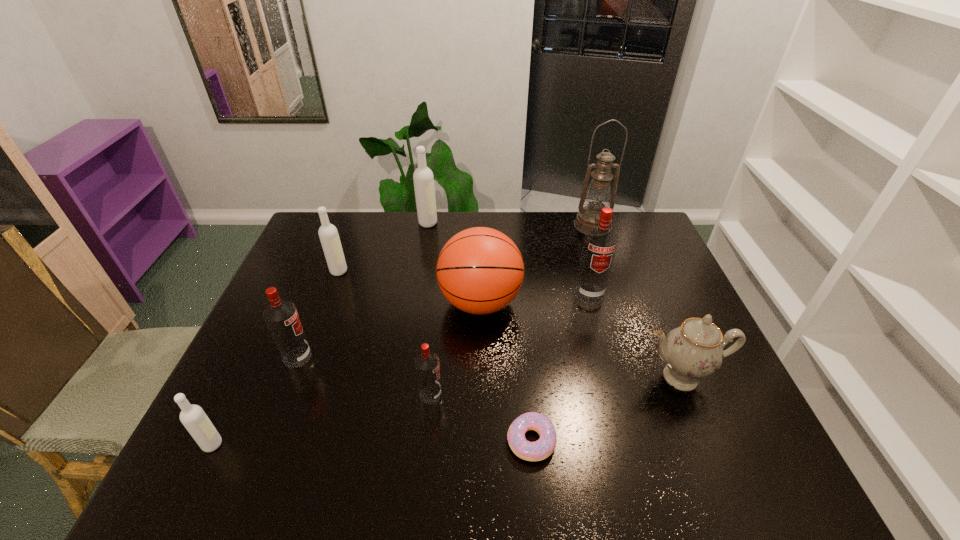
Locate an element on the screen. The width and height of the screenshot is (960, 540). vacant region located on the back of the orange basketball is located at coordinates point(480,239).

At what (x,y) coordinates should I click in order to perform the action: click on free space located 0.380m on the right of the second farthest vodka. Please return your answer as a coordinate pair (x, y). The height and width of the screenshot is (540, 960). Looking at the image, I should click on (465, 271).

This screenshot has width=960, height=540. I want to click on free space located 0.380m on the front label of the third nearest vodka, so click(x=456, y=357).

At what (x,y) coordinates should I click in order to perform the action: click on free space located on the spout of the chinaware. Please return your answer as a coordinate pair (x, y). The width and height of the screenshot is (960, 540). Looking at the image, I should click on (700, 426).

Where is `blank area located on the front label of the fifth vodka from left to right`? This screenshot has height=540, width=960. blank area located on the front label of the fifth vodka from left to right is located at coordinates (532, 395).

The width and height of the screenshot is (960, 540). I want to click on vacant point located 0.070m on the right of the leftmost white vodka, so click(253, 444).

Find the location of a particular element. Image resolution: width=960 pixels, height=540 pixels. free region located 0.230m on the back of the shortest object is located at coordinates (522, 343).

In order to click on oil lamp that is at the far edge in this screenshot , I will do `click(598, 195)`.

Where is `vodka that is at the far edge`? vodka that is at the far edge is located at coordinates (423, 178).

At what (x,y) coordinates should I click in order to perform the action: click on vodka that is at the near edge. Please return your answer as a coordinate pair (x, y). This screenshot has width=960, height=540. Looking at the image, I should click on (194, 419).